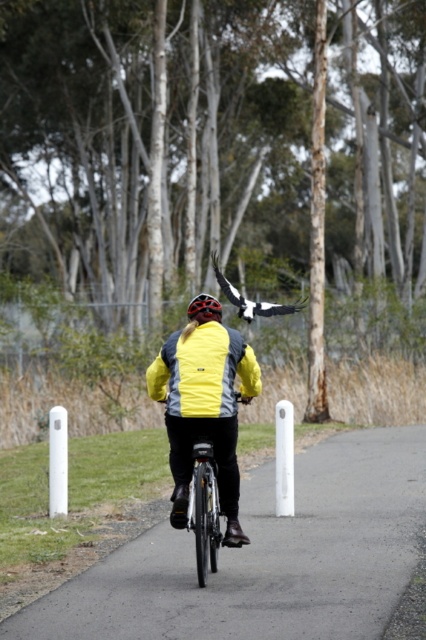
Is yellow reflective jacket at center positioned in front of yellow matte jacket at center?

No, it is behind yellow matte jacket at center.

The height and width of the screenshot is (640, 426). I want to click on yellow reflective jacket at center, so [x=204, y=406].

This screenshot has width=426, height=640. I want to click on yellow reflective jacket at center, so click(204, 406).

Does asphalt road at center have a smaller size compared to shiny black bicycle at center?

Actually, asphalt road at center might be larger than shiny black bicycle at center.

Which is more to the right, asphalt road at center or shiny black bicycle at center?

asphalt road at center is more to the right.

This screenshot has height=640, width=426. I want to click on asphalt road at center, so click(x=265, y=557).

Does asphalt road at center have a lesser height compared to yellow matte jacket at center?

Yes.

Where is `asphalt road at center`? asphalt road at center is located at coordinates (265, 557).